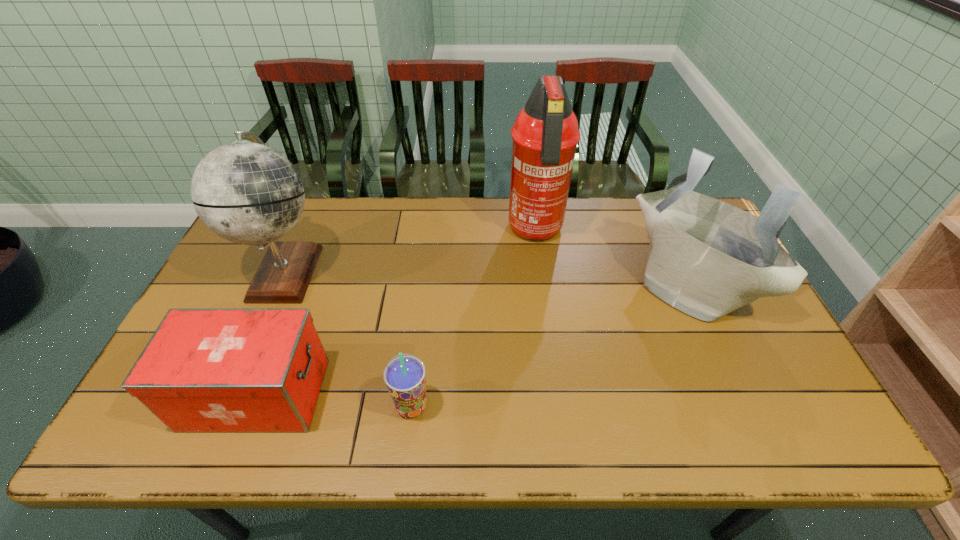
Where is `vacant space at the near edge`? The height and width of the screenshot is (540, 960). vacant space at the near edge is located at coordinates (409, 447).

This screenshot has width=960, height=540. In the image, there is a desktop. In order to click on free space at the left edge in this screenshot , I will do (220, 300).

This screenshot has height=540, width=960. In the image, there is a desktop. In order to click on vacant space at the right edge in this screenshot , I will do `click(757, 401)`.

At what (x,y) coordinates should I click in order to perform the action: click on free space between the fire extinguisher and the first-aid kit. Please return your answer as a coordinate pair (x, y). The image size is (960, 540). Looking at the image, I should click on (396, 313).

Locate an element on the screen. free space between the globe and the rightmost object is located at coordinates (488, 278).

Find the location of a particular element. vacant space that is in between the fourth object from left to right and the third object from left to right is located at coordinates (473, 319).

At what (x,y) coordinates should I click in order to perform the action: click on vacant area that lies between the shopping bag and the globe. Please return your answer as a coordinate pair (x, y). Image resolution: width=960 pixels, height=540 pixels. Looking at the image, I should click on (x=488, y=278).

This screenshot has height=540, width=960. What are the coordinates of `empty space that is in between the rightmost object and the globe` in the screenshot? It's located at click(488, 278).

Where is `empty space between the globe and the smoothie`? empty space between the globe and the smoothie is located at coordinates (349, 339).

The width and height of the screenshot is (960, 540). I want to click on blank region between the fire extinguisher and the shopping bag, so 612,258.